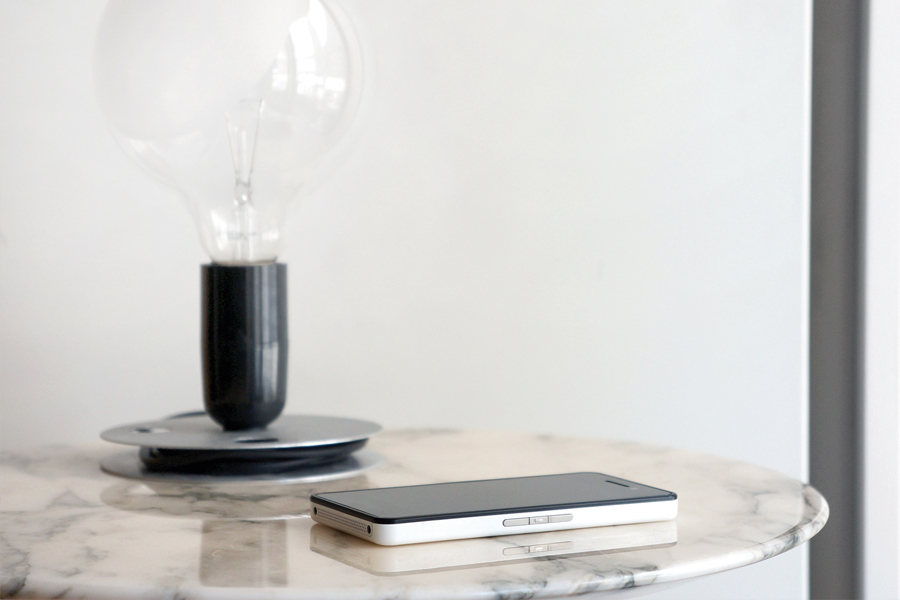
Where is `bulb`? The image size is (900, 600). bulb is located at coordinates (194, 126).